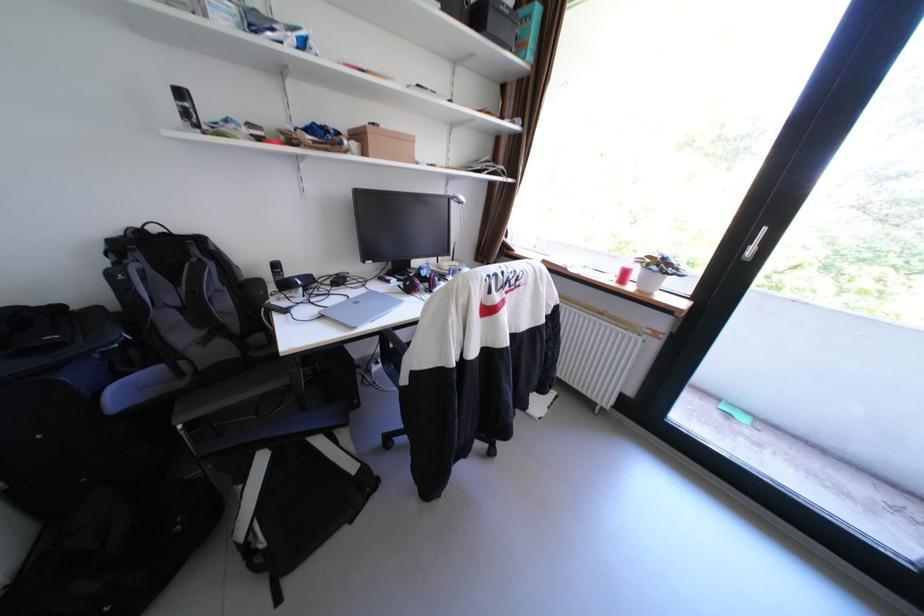
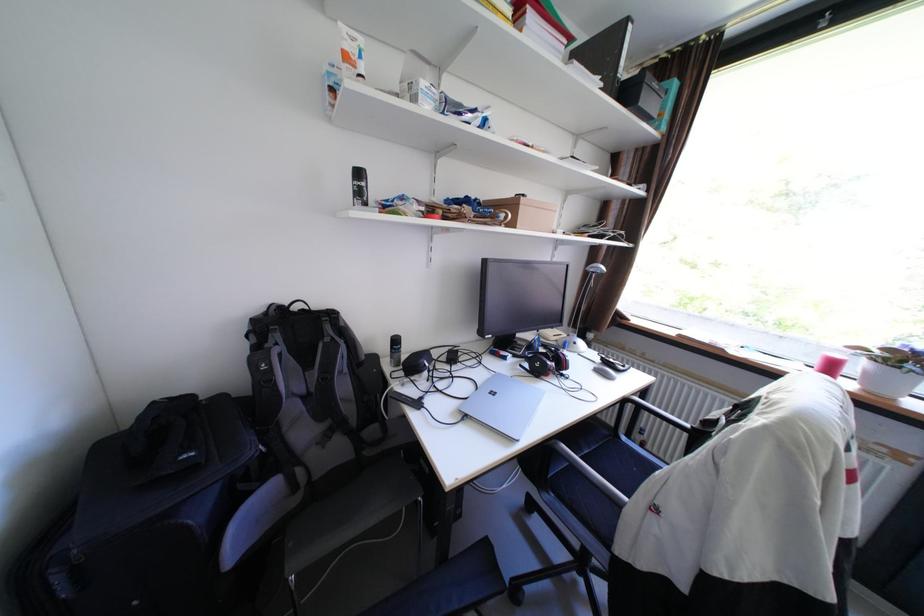
Question: Based on the continuous images, in which direction is the camera rotating? Reply with the corresponding letter.

Choices:
 (A) Left
 (B) Right
 (C) Up
 (D) Down

Answer: (C)